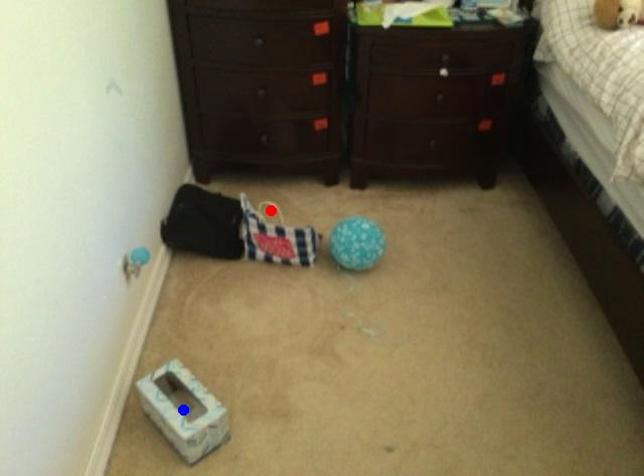
Question: Two points are marked on the image. Which point is closer to the camera?

Choices:
 (A) Blue point is closer.
 (B) Red point is closer.

Answer: (A)